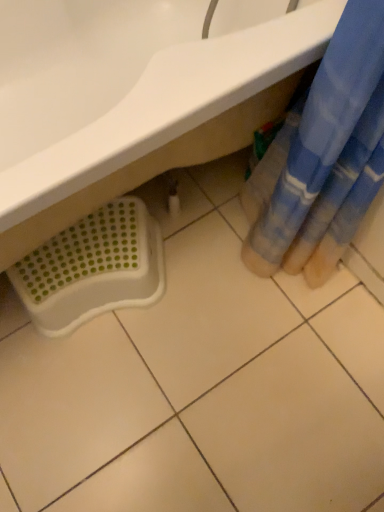
You are a GUI agent. You are given a task and a screenshot of the screen. Output one action in this format:
    pyautogui.click(x=<x>, y=<y>)
    Task: Click on the white glossy bathtub at upper left
    This screenshot has width=384, height=512.
    Given the screenshot: What is the action you would take?
    pyautogui.click(x=131, y=102)

Image resolution: width=384 pixels, height=512 pixels. What do you see at coordinates (131, 102) in the screenshot? I see `white glossy bathtub at upper left` at bounding box center [131, 102].

This screenshot has width=384, height=512. I want to click on white glossy bathtub at upper left, so click(x=131, y=102).